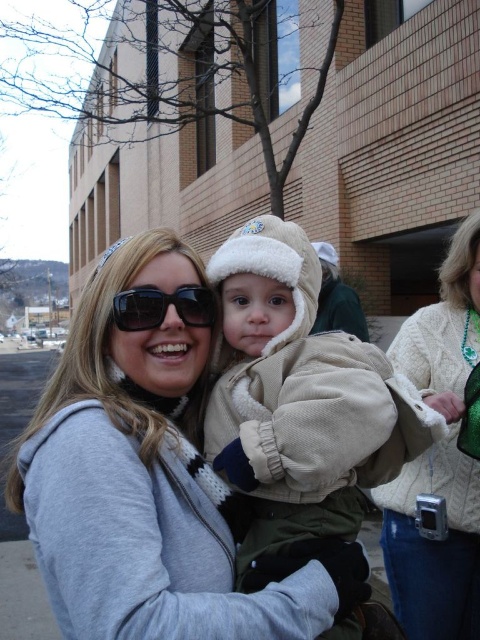
Question: Is matte gray hoodie at center behind matte black sunglasses at center?

Choices:
 (A) yes
 (B) no

Answer: (B)

Question: Among these points, which one is nearest to the camera?

Choices:
 (A) tap(475, 250)
 (B) tap(152, 298)

Answer: (B)

Question: Based on their relative distances, which object is farther from the matte gray hoodie at center?

Choices:
 (A) ivory cable knit sweater at lower right
 (B) matte black sunglasses at center
 (C) beige fleece jacket at center

Answer: (A)

Question: Among these points, which one is farthest from the camera?

Choices:
 (A) (119, 305)
 (B) (110, 346)
 (C) (300, 529)

Answer: (B)

Question: Can you confirm if ivory cable knit sweater at lower right is thinner than matte black sunglasses at center?

Choices:
 (A) no
 (B) yes

Answer: (A)

Question: Does beige fleece jacket at center have a smaller size compared to ivory cable knit sweater at lower right?

Choices:
 (A) no
 (B) yes

Answer: (B)